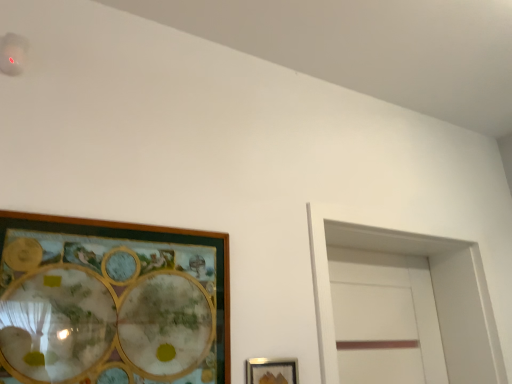
Image resolution: width=512 pixels, height=384 pixels. I want to click on white matte glass door at right, so click(432, 284).

Where is `white matte glass door at right`? Image resolution: width=512 pixels, height=384 pixels. white matte glass door at right is located at coordinates (432, 284).

Measure the distance between white matte glass door at right and metallic silver picture frame at lower center, positioned as the second picture frame in left-to-right order.

white matte glass door at right is 71.06 centimeters from metallic silver picture frame at lower center, positioned as the second picture frame in left-to-right order.

Which point is more forward, (382,238) or (253,383)?

The point (253,383) is closer.

From the image's perspective, which one is positioned higher, white matte glass door at right or metallic silver picture frame at lower center, positioned as the second picture frame in left-to-right order?

white matte glass door at right appears higher in the image.

Is white matte glass door at right bigger or smaller than metallic silver picture frame at lower center, the first picture frame positioned from the right?

white matte glass door at right is bigger than metallic silver picture frame at lower center, the first picture frame positioned from the right.

How different are the orientations of wooden picture frame at left, marked as the second picture frame in a right-to-left arrangement, and white matte glass door at right in degrees?

The angular difference between wooden picture frame at left, marked as the second picture frame in a right-to-left arrangement, and white matte glass door at right is 0.185 degrees.

Does wooden picture frame at left, which is the first picture frame in left-to-right order, lie in front of white matte glass door at right?

Yes, it is.

Measure the distance from wooden picture frame at left, marked as the second picture frame in a right-to-left arrangement, to white matte glass door at right.

wooden picture frame at left, marked as the second picture frame in a right-to-left arrangement, is 30.20 inches away from white matte glass door at right.

Considering the sizes of objects wooden picture frame at left, the second picture frame when ordered from bottom to top, and white matte glass door at right in the image provided, who is bigger, wooden picture frame at left, the second picture frame when ordered from bottom to top, or white matte glass door at right?

white matte glass door at right.

Which object is positioned more to the left, metallic silver picture frame at lower center, the first picture frame positioned from the right, or white matte glass door at right?

Positioned to the left is metallic silver picture frame at lower center, the first picture frame positioned from the right.

Can you see metallic silver picture frame at lower center, positioned as the second picture frame in left-to-right order, touching white matte glass door at right?

metallic silver picture frame at lower center, positioned as the second picture frame in left-to-right order, and white matte glass door at right are not in contact.

Considering the sizes of objects metallic silver picture frame at lower center, the first picture frame positioned from the right, and white matte glass door at right in the image provided, who is thinner, metallic silver picture frame at lower center, the first picture frame positioned from the right, or white matte glass door at right?

metallic silver picture frame at lower center, the first picture frame positioned from the right.

From the image's perspective, between wooden picture frame at left, which is the first picture frame in top-to-bottom order, and metallic silver picture frame at lower center, the first picture frame positioned from the right, who is located below?

From the image's view, metallic silver picture frame at lower center, the first picture frame positioned from the right, is below.

From a real-world perspective, who is located lower, wooden picture frame at left, which is the first picture frame in top-to-bottom order, or metallic silver picture frame at lower center, the first picture frame positioned from the right?

metallic silver picture frame at lower center, the first picture frame positioned from the right, from a real-world perspective.

Could you tell me if wooden picture frame at left, marked as the second picture frame in a right-to-left arrangement, is facing metallic silver picture frame at lower center, the 2th picture frame from the top?

No, wooden picture frame at left, marked as the second picture frame in a right-to-left arrangement, is not facing towards metallic silver picture frame at lower center, the 2th picture frame from the top.

From the picture: Based on their sizes in the image, would you say wooden picture frame at left, the second picture frame when ordered from bottom to top, is bigger or smaller than metallic silver picture frame at lower center, the first picture frame ordered from the bottom?

wooden picture frame at left, the second picture frame when ordered from bottom to top, is bigger than metallic silver picture frame at lower center, the first picture frame ordered from the bottom.

Considering the sizes of metallic silver picture frame at lower center, the 2th picture frame from the top, and wooden picture frame at left, which is the first picture frame in top-to-bottom order, in the image, is metallic silver picture frame at lower center, the 2th picture frame from the top, taller or shorter than wooden picture frame at left, which is the first picture frame in top-to-bottom order,?

In the image, metallic silver picture frame at lower center, the 2th picture frame from the top, appears to be shorter than wooden picture frame at left, which is the first picture frame in top-to-bottom order.

Does metallic silver picture frame at lower center, the first picture frame ordered from the bottom, have a larger size compared to wooden picture frame at left, marked as the second picture frame in a right-to-left arrangement?

No, metallic silver picture frame at lower center, the first picture frame ordered from the bottom, is not bigger than wooden picture frame at left, marked as the second picture frame in a right-to-left arrangement.

Is metallic silver picture frame at lower center, the first picture frame ordered from the bottom, wider or thinner than wooden picture frame at left, which is the first picture frame in left-to-right order?

Clearly, metallic silver picture frame at lower center, the first picture frame ordered from the bottom, has less width compared to wooden picture frame at left, which is the first picture frame in left-to-right order.

Which object is more forward, white matte glass door at right or wooden picture frame at left, which is the first picture frame in left-to-right order?

wooden picture frame at left, which is the first picture frame in left-to-right order, is more forward.

This screenshot has height=384, width=512. I want to click on glass door that appears on the right of wooden picture frame at left, marked as the second picture frame in a right-to-left arrangement, so click(x=432, y=284).

Does white matte glass door at right have a greater height compared to wooden picture frame at left, marked as the second picture frame in a right-to-left arrangement?

Correct, white matte glass door at right is much taller as wooden picture frame at left, marked as the second picture frame in a right-to-left arrangement.

Which of these two, white matte glass door at right or wooden picture frame at left, the second picture frame when ordered from bottom to top, is bigger?

white matte glass door at right is bigger.

Locate an element on the screen. The height and width of the screenshot is (384, 512). picture frame below the white matte glass door at right (from the image's perspective) is located at coordinates (271, 371).

Which picture frame is the 2nd one when counting from the left side of the white matte glass door at right? Please provide its 2D coordinates.

[(112, 302)]

From the picture: From the image, which object appears to be nearer to wooden picture frame at left, the second picture frame when ordered from bottom to top, white matte glass door at right or metallic silver picture frame at lower center, the first picture frame ordered from the bottom?

Among the two, metallic silver picture frame at lower center, the first picture frame ordered from the bottom, is located nearer to wooden picture frame at left, the second picture frame when ordered from bottom to top.

Based on the photo, from the image, which object appears to be farther from white matte glass door at right, metallic silver picture frame at lower center, the first picture frame positioned from the right, or wooden picture frame at left, the second picture frame when ordered from bottom to top?

wooden picture frame at left, the second picture frame when ordered from bottom to top.

Based on the photo, looking at the image, which one is located closer to metallic silver picture frame at lower center, the 2th picture frame from the top, wooden picture frame at left, which is the first picture frame in left-to-right order, or white matte glass door at right?

Based on the image, wooden picture frame at left, which is the first picture frame in left-to-right order, appears to be nearer to metallic silver picture frame at lower center, the 2th picture frame from the top.

Based on their spatial positions, is wooden picture frame at left, the second picture frame when ordered from bottom to top, or metallic silver picture frame at lower center, the first picture frame positioned from the right, closer to white matte glass door at right?

Based on the image, metallic silver picture frame at lower center, the first picture frame positioned from the right, appears to be nearer to white matte glass door at right.

Looking at the image, which one is located further to metallic silver picture frame at lower center, positioned as the second picture frame in left-to-right order, white matte glass door at right or wooden picture frame at left, which is the first picture frame in left-to-right order?

white matte glass door at right is positioned further to the anchor metallic silver picture frame at lower center, positioned as the second picture frame in left-to-right order.

From the image, which object appears to be farther from wooden picture frame at left, marked as the second picture frame in a right-to-left arrangement, metallic silver picture frame at lower center, the first picture frame positioned from the right, or white matte glass door at right?

white matte glass door at right.

Where is `picture frame located between wooden picture frame at left, marked as the second picture frame in a right-to-left arrangement, and white matte glass door at right in the left-right direction`? picture frame located between wooden picture frame at left, marked as the second picture frame in a right-to-left arrangement, and white matte glass door at right in the left-right direction is located at coordinates (271, 371).